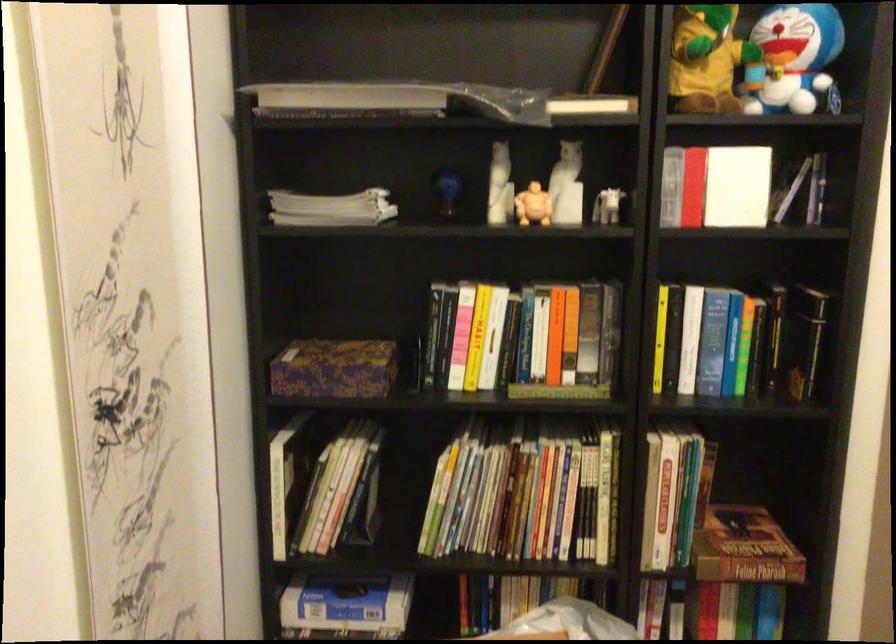
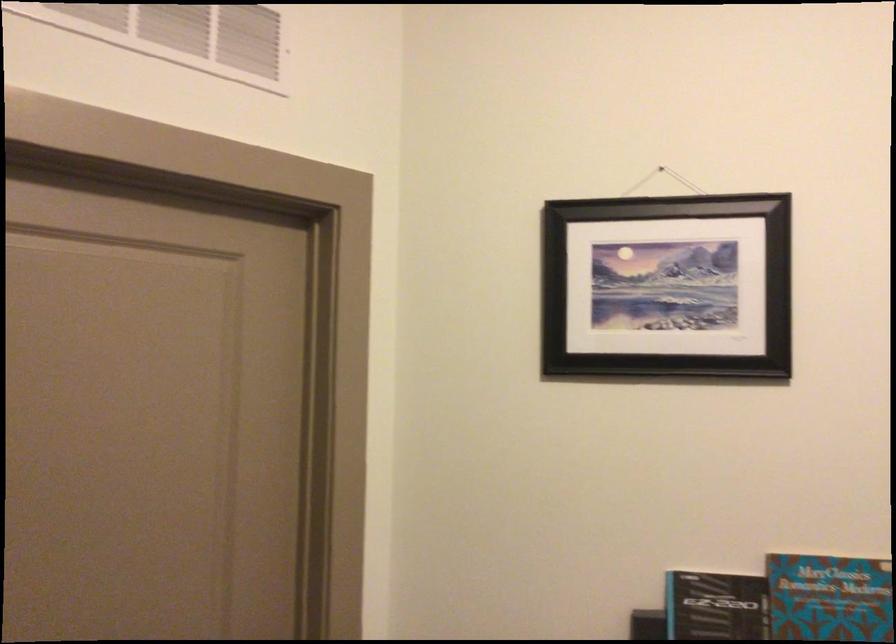
Question: The first image is from the beginning of the video and the second image is from the end. How did the camera likely rotate when shooting the video?

Choices:
 (A) Left
 (B) Right
 (C) Up
 (D) Down

Answer: (B)